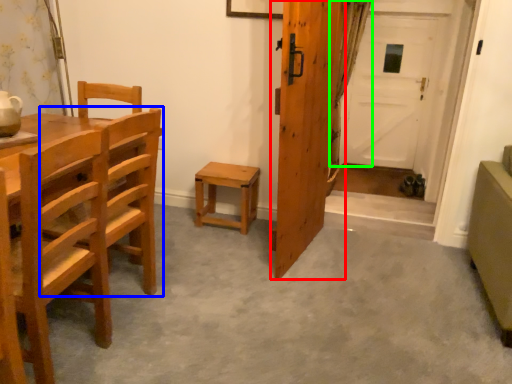
Question: Which object is positioned closest to door (highlighted by a red box)? Select from chair (highlighted by a blue box) and curtain (highlighted by a green box).

Choices:
 (A) chair
 (B) curtain

Answer: (A)